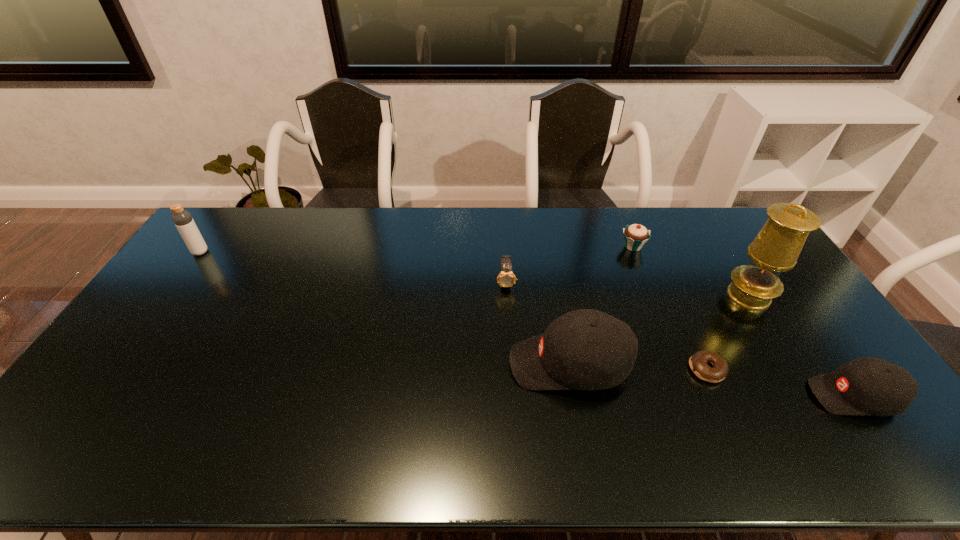
The height and width of the screenshot is (540, 960). In order to click on the left baseball cap in this screenshot , I will do `click(585, 349)`.

I want to click on the fifth shortest object, so click(x=585, y=349).

The width and height of the screenshot is (960, 540). Identify the location of the shorter baseball cap. (866, 386).

Locate an element on the screen. cupcake is located at coordinates (635, 235).

Where is `watch`? This screenshot has height=540, width=960. watch is located at coordinates (506, 278).

This screenshot has height=540, width=960. What are the coordinates of `the leftmost object` in the screenshot? It's located at coord(182,219).

Identify the location of the second tallest object. This screenshot has height=540, width=960. (182, 219).

Image resolution: width=960 pixels, height=540 pixels. What are the coordinates of `the tallest object` in the screenshot? It's located at (776, 248).

Identify the location of the shortest object. Image resolution: width=960 pixels, height=540 pixels. (698, 361).

The image size is (960, 540). I want to click on free spot located 0.070m with a logo on the front of the taller baseball cap, so click(484, 364).